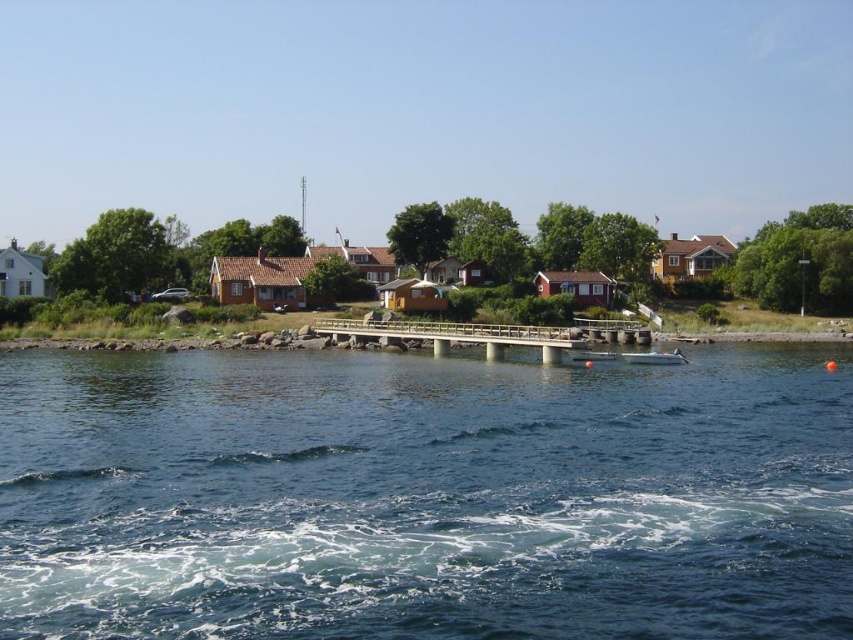
You are a photographer planning to capture the blue water at lower center and the wooden bridge at center in a single shot. Based on their heights, which object should you position closer to the camera to ensure both are fully visible in the frame?

The blue water at lower center has a lesser height compared to wooden bridge at center, so you should position the wooden bridge at center closer to the camera to ensure both objects are fully visible in the frame.